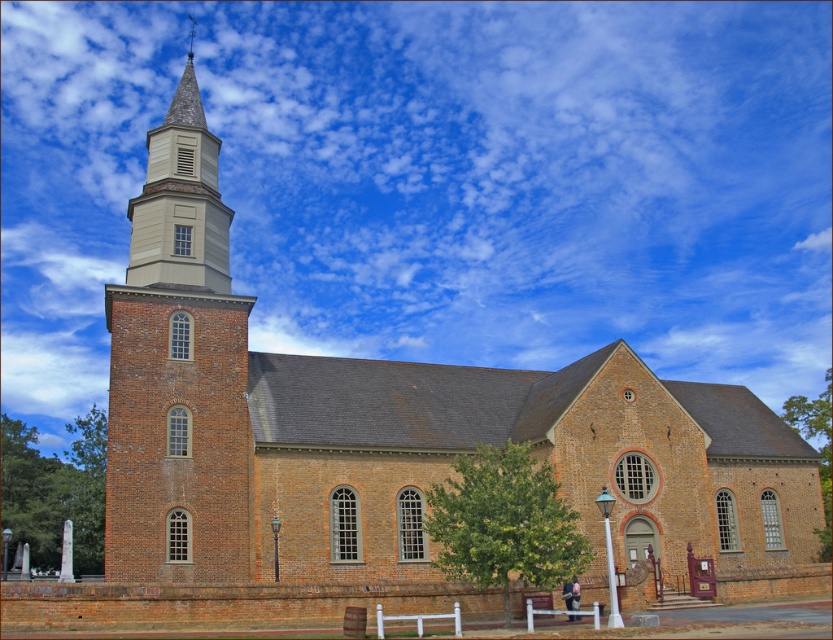
Between brick steeple at left and light beige wood bell tower at upper center, which one appears on the left side from the viewer's perspective?

light beige wood bell tower at upper center is more to the left.

At what (x,y) coordinates should I click in order to perform the action: click on brick steeple at left. Please return your answer as a coordinate pair (x, y). This screenshot has width=833, height=640. Looking at the image, I should click on (178, 371).